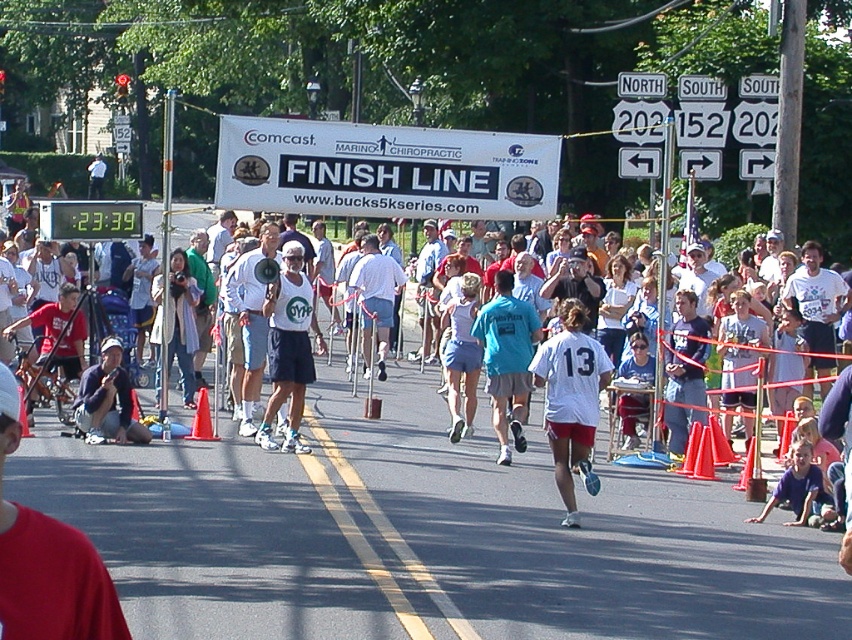
Is white matte megaphone at center to the right of teal fabric shirt at center from the viewer's perspective?

No, white matte megaphone at center is not to the right of teal fabric shirt at center.

At what (x,y) coordinates should I click in order to perform the action: click on white matte megaphone at center. Please return your answer as a coordinate pair (x, y). The image size is (852, 640). Looking at the image, I should click on (288, 348).

Does point (560, 420) come in front of point (281, 312)?

Yes, it is in front of point (281, 312).

Is point (567, 476) farther from camera compared to point (304, 444)?

No.

Locate an element on the screen. This screenshot has width=852, height=640. white matte shirt at center is located at coordinates (571, 401).

Does white matte shirt at center have a lesser height compared to teal fabric shirt at center?

Yes.

Locate an element on the screen. This screenshot has height=640, width=852. white matte shirt at center is located at coordinates pyautogui.click(x=571, y=401).

This screenshot has height=640, width=852. I want to click on white matte shirt at center, so click(x=571, y=401).

Identify the location of white matte shirt at center. The height and width of the screenshot is (640, 852). (571, 401).